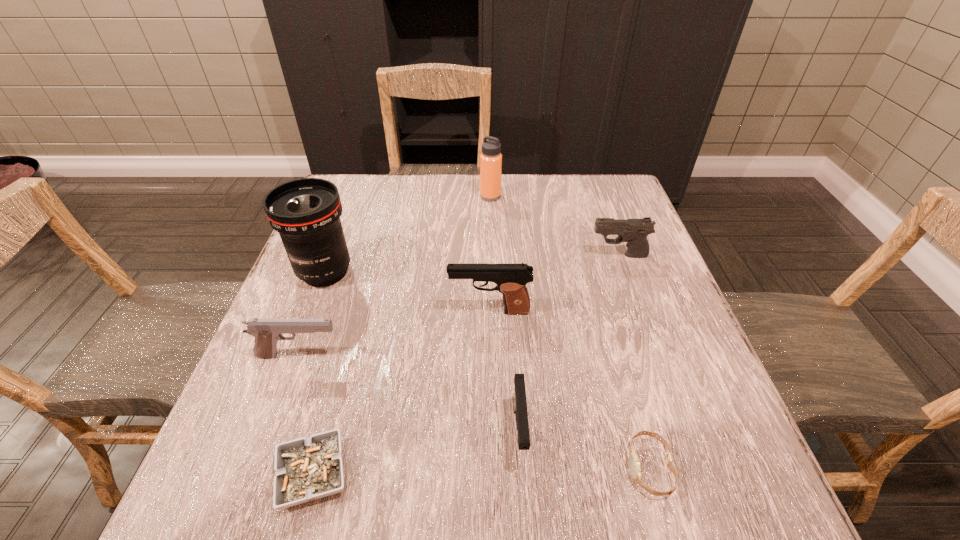
The image size is (960, 540). Find the location of `free space located at the barrel of the leftmost pistol`. free space located at the barrel of the leftmost pistol is located at coordinates (474, 356).

Find the location of a particular element. This screenshot has width=960, height=540. free space located on the front-facing side of the third shortest object is located at coordinates (524, 504).

Where is `free space located 0.350m on the face of the watch`? The image size is (960, 540). free space located 0.350m on the face of the watch is located at coordinates (410, 468).

The height and width of the screenshot is (540, 960). I want to click on vacant space positioned on the face of the watch, so click(x=453, y=468).

I want to click on vacant point located on the face of the watch, so coord(485,468).

In order to click on free space located on the back of the shortest object in this screenshot , I will do `click(335, 396)`.

Locate an element on the screen. The image size is (960, 540). object that is at the far edge is located at coordinates (490, 159).

Locate an element on the screen. Image resolution: width=960 pixels, height=540 pixels. pistol present at the near edge is located at coordinates (519, 396).

The width and height of the screenshot is (960, 540). Identify the location of watch situated at the near edge. (634, 463).

The image size is (960, 540). I want to click on ashtray positioned at the near edge, so click(x=307, y=469).